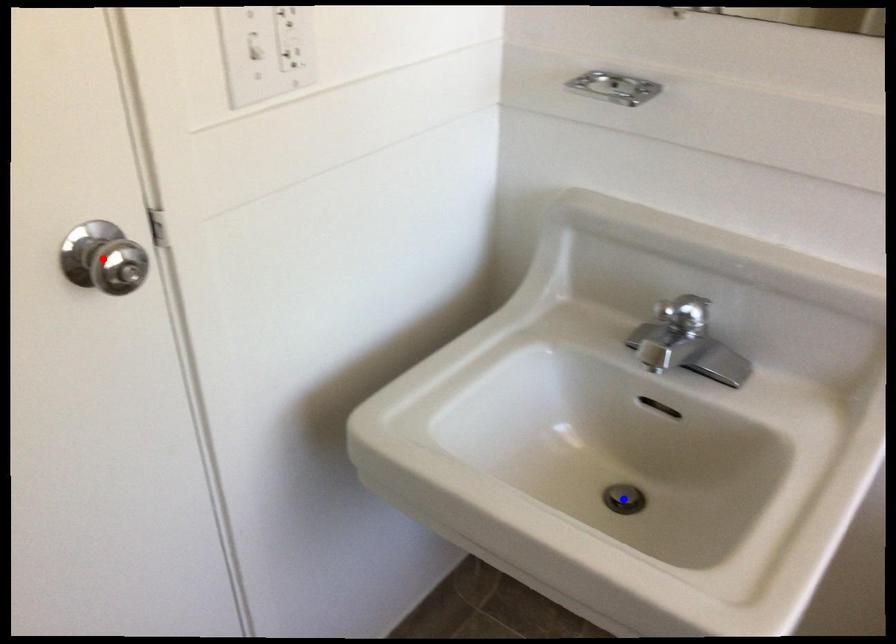
Question: Two points are marked on the image. Which point is closer to the camera?

Choices:
 (A) Blue point is closer.
 (B) Red point is closer.

Answer: (B)